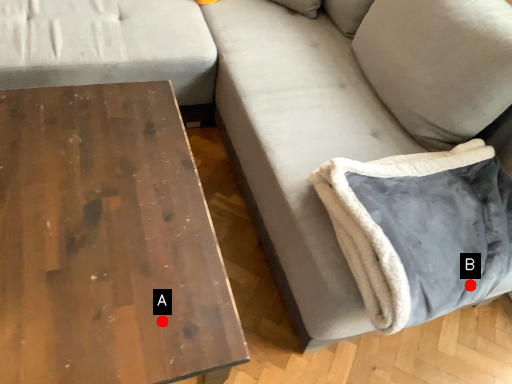
Question: Two points are circled on the image, labeled by A and B beside each circle. Which point appears closest to the camera in this image?

Choices:
 (A) A is closer
 (B) B is closer

Answer: (A)